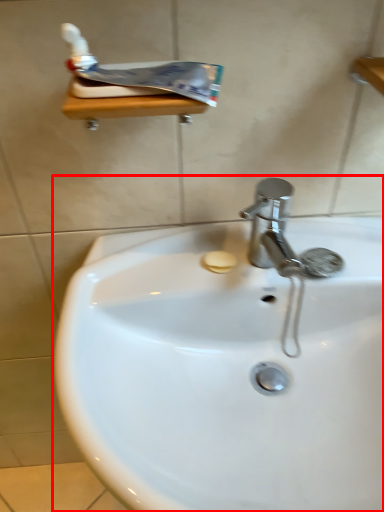
Question: From the image's perspective, what is the correct spatial relationship of sink (annotated by the red box) in relation to toothpaste?

Choices:
 (A) below
 (B) above

Answer: (A)